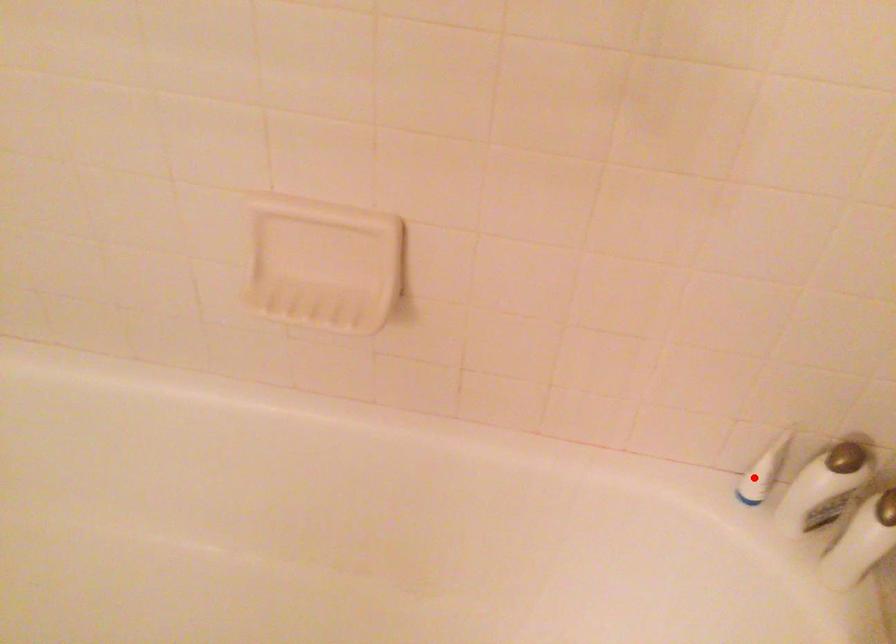
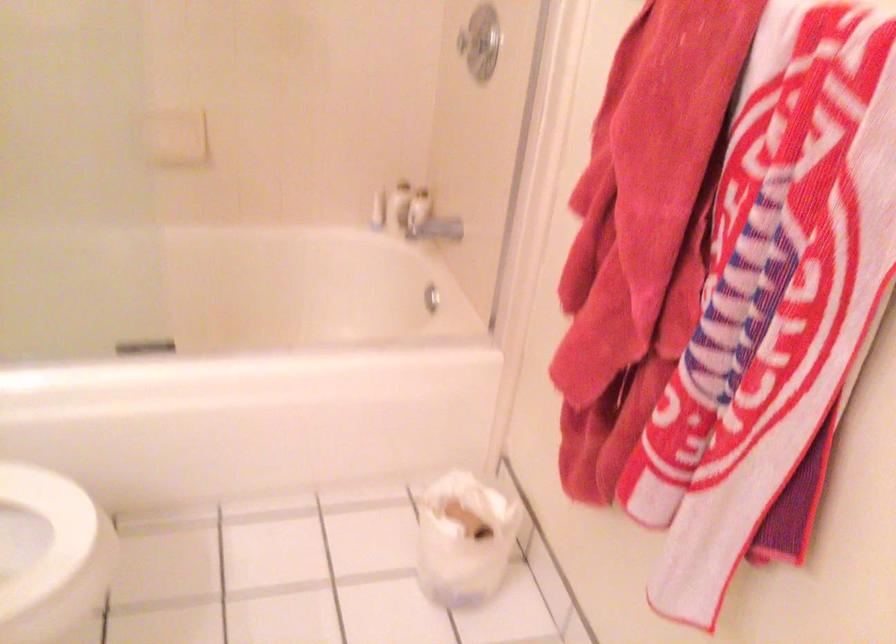
Where in the second image is the point corresponding to the highlighted location from the first image?

(378, 211)